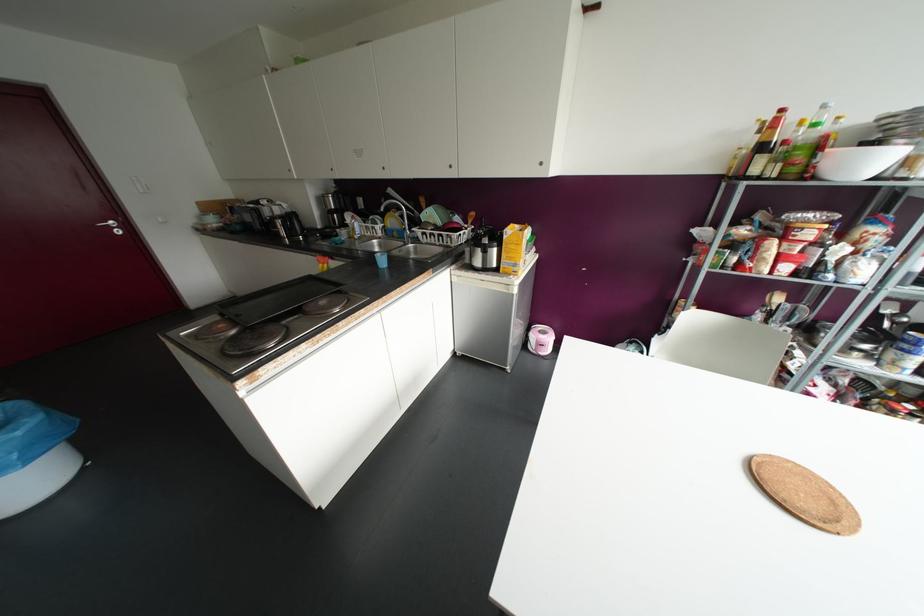
Which object does [805,145] point to?

It refers to a clear glass bottle.